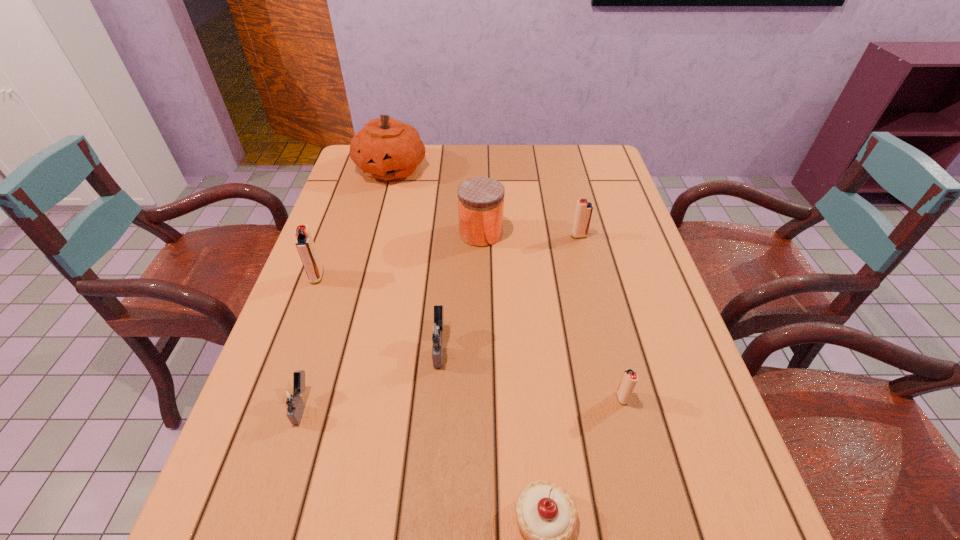
Select which object is the fifth closest to the farthest object. Please provide its 2D coordinates. Your answer should be formatted as a tuple, i.e. [(x, y)], where the tuple contains the x and y coordinates of a point satisfying the conditions above.

[(290, 397)]

Find the location of a particular element. The height and width of the screenshot is (540, 960). igniter that is the fourth closest to the third nearest igniter is located at coordinates (584, 209).

Choose which igniter is the second nearest neighbor to the farthest igniter. Please provide its 2D coordinates. Your answer should be formatted as a tuple, i.e. [(x, y)], where the tuple contains the x and y coordinates of a point satisfying the conditions above.

[(630, 378)]

You are a GUI agent. You are given a task and a screenshot of the screen. Output one action in this format:
    pyautogui.click(x=<x>, y=<y>)
    Task: Click on the closest red igniter relative to the nearer gray igniter
    
    Given the screenshot: What is the action you would take?
    pyautogui.click(x=304, y=242)

The height and width of the screenshot is (540, 960). I want to click on red igniter that stands as the closest to the leftmost red igniter, so click(584, 209).

You are a GUI agent. You are given a task and a screenshot of the screen. Output one action in this format:
    pyautogui.click(x=<x>, y=<y>)
    Task: Click on the free spot that satisfies the following two spatial constraints: 1. on the front-facing side of the jar; 2. on the left side of the tallest object
    This screenshot has height=540, width=960.
    Given the screenshot: What is the action you would take?
    pyautogui.click(x=373, y=233)